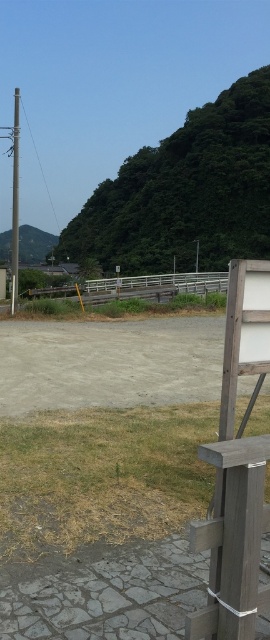
Question: Which of the following is the farthest from the observer?

Choices:
 (A) (252, 492)
 (B) (17, 144)

Answer: (B)

Question: From the image, what is the correct spatial relationship of wooden bench at lower right in relation to metallic gray pole at left?

Choices:
 (A) left
 (B) right

Answer: (B)

Question: Can you confirm if wooden bench at lower right is positioned to the left of metallic gray pole at left?

Choices:
 (A) yes
 (B) no

Answer: (B)

Question: Among these points, which one is farthest from the camera?

Choices:
 (A) (11, 227)
 (B) (244, 504)

Answer: (A)

Question: Is wooden bench at lower right closer to camera compared to metallic gray pole at left?

Choices:
 (A) no
 (B) yes

Answer: (B)